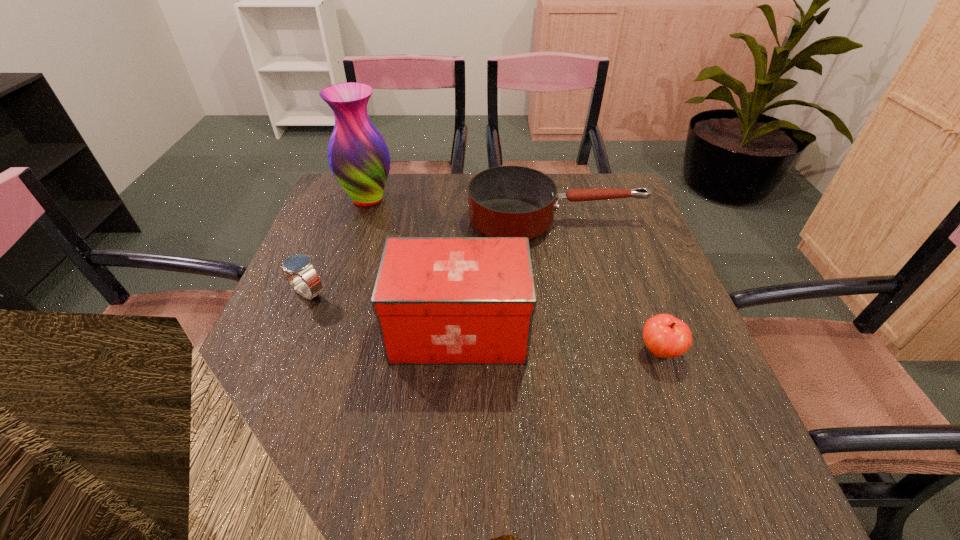
Locate an element on the screen. The width and height of the screenshot is (960, 540). pan that is at the far edge is located at coordinates click(507, 201).

In order to click on vase positioned at the left edge in this screenshot , I will do `click(359, 158)`.

Find the location of a particular element. watch that is positioned at the left edge is located at coordinates tap(299, 265).

Find the location of a particular element. The height and width of the screenshot is (540, 960). pan present at the right edge is located at coordinates tap(507, 201).

Identify the location of apple present at the right edge. The width and height of the screenshot is (960, 540). (666, 336).

In order to click on object located at the far left corner in this screenshot , I will do `click(359, 158)`.

The image size is (960, 540). What are the coordinates of `object that is positioned at the far right corner` in the screenshot? It's located at (507, 201).

In the image, there is a desktop. Identify the location of vacant space at the near edge. The width and height of the screenshot is (960, 540). (428, 489).

Locate an element on the screen. This screenshot has width=960, height=540. free point at the left edge is located at coordinates (314, 424).

In the image, there is a desktop. Where is `vacant region at the right edge`? vacant region at the right edge is located at coordinates (620, 241).